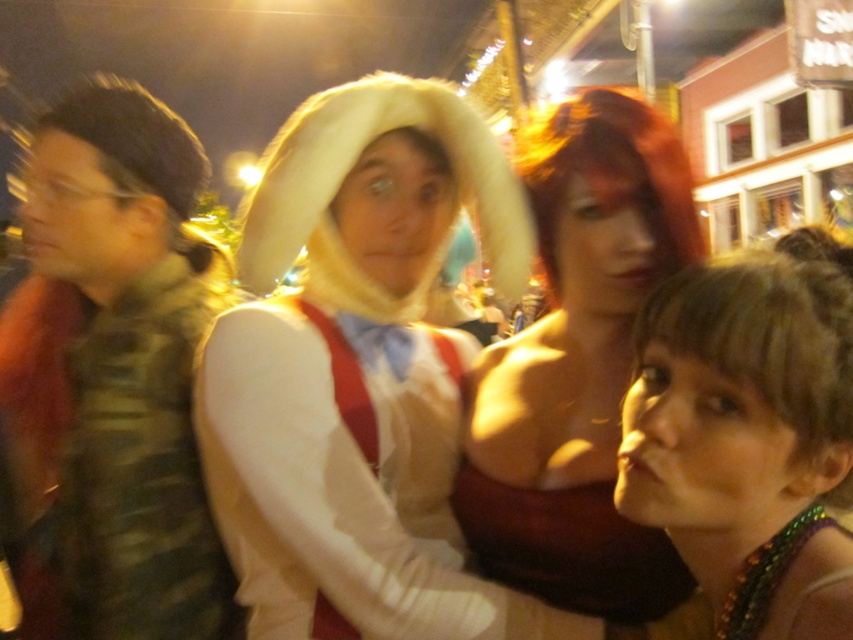
You are at a social event and want to take a photo of two specific points in the scene. The first point is located at coordinates point [90,358] and the second at point [712,516]. Given that you need to focus on the closer point to ensure clarity, which point should you adjust your camera settings for?

Point [90,358] is closer to the viewer than point [712,516], so you should adjust your camera settings to focus on point [90,358] for clarity.

You are organizing a costume party and need to ensure that all accessories are visible in photos. Given the scene described, which accessory between the camouflage fabric vest at left and the shiny green necklace at lower right is more likely to remain visible in the blurry photo?

The camouflage fabric vest at left is more likely to remain visible in the blurry photo because it has a larger size compared to the shiny green necklace at lower right, making it easier to discern despite the blur.